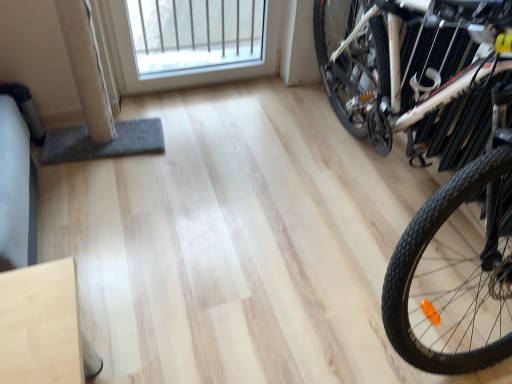
You are a GUI agent. You are given a task and a screenshot of the screen. Output one action in this format:
    pyautogui.click(x=<x>, y=<y>)
    Task: Click on the vacant space underneath white matte bicycle at right (from a real-world perspective)
    The width and height of the screenshot is (512, 384).
    Given the screenshot: What is the action you would take?
    pyautogui.click(x=365, y=213)